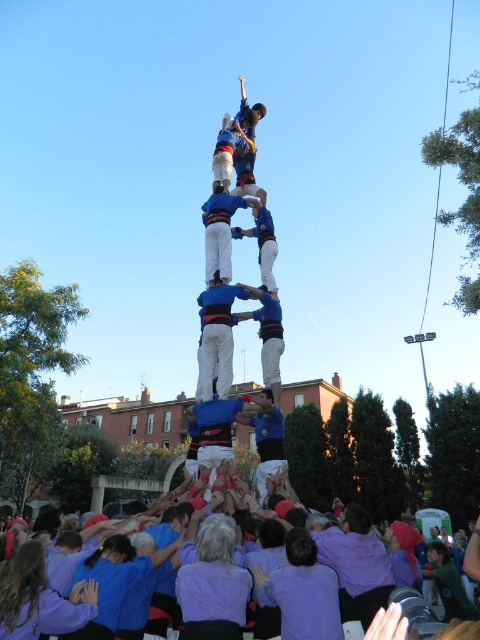
You are a photographer at the event and want to capture a photo of the white cotton shirt at center and the blue fabric person at center. From your current position, which one is closer to you?

The white cotton shirt at center is closer to you because the blue fabric person at center is behind it.

You are a photographer standing at the point with coordinates point (x=60, y=611). You want to take a photo of the castell tower. What is the color of the clothing of the people you are standing on?

The point (x=60, y=611) is on purple cotton shirts at lower center, so the color of the clothing is purple.

You are a photographer at the event and want to capture both the purple cotton shirts at lower center and the white cotton shirt at center in a single frame. Which group of people should you focus on first to ensure both are visible in your photo?

You should focus on the purple cotton shirts at lower center first because they are larger in size compared to the white cotton shirt at center, ensuring they are visible even if positioned further back.